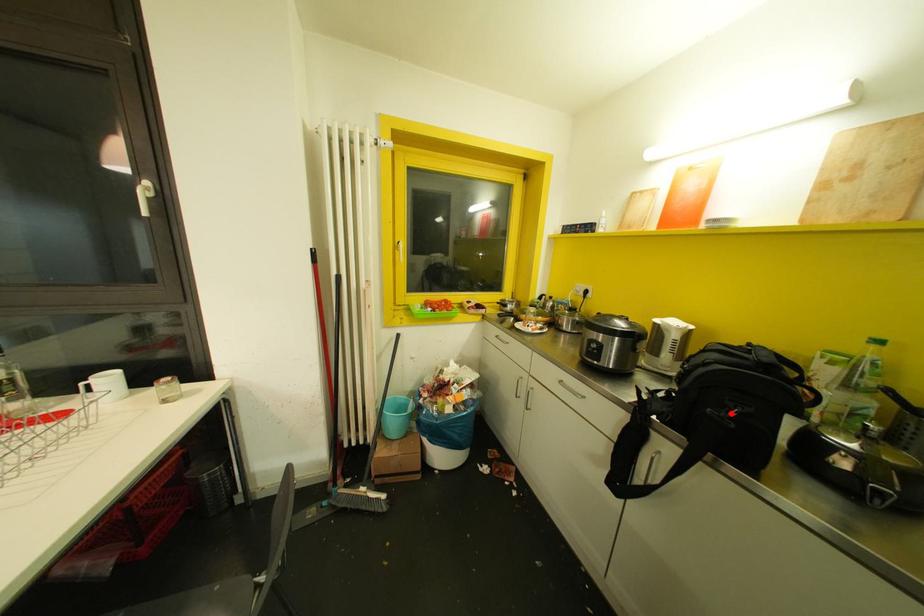
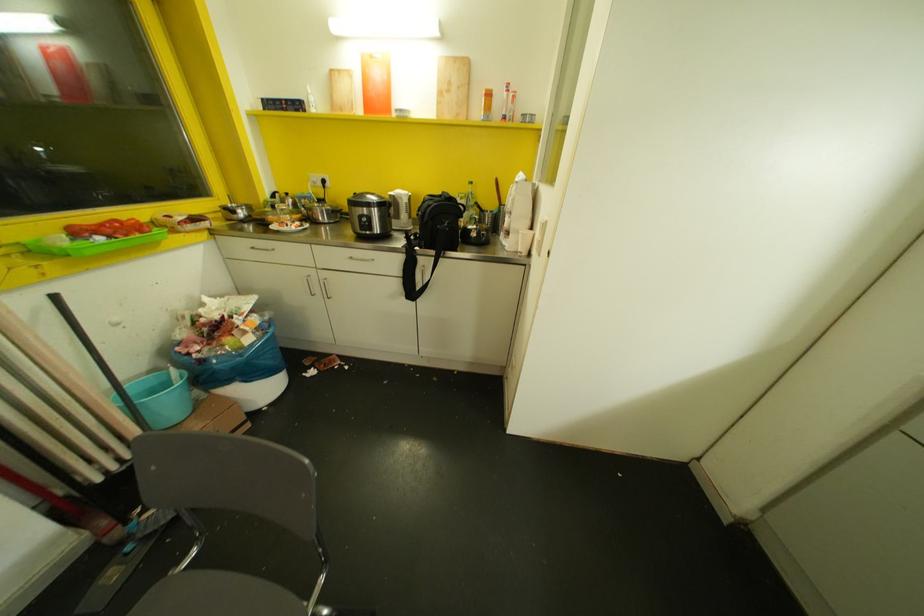
Question: I am providing you with two images of the same scene from different viewpoints. A red point is shown in image1. For the corresponding object point in image2, is it positioned nearer or farther from the camera?

Choices:
 (A) Nearer
 (B) Farther

Answer: (A)